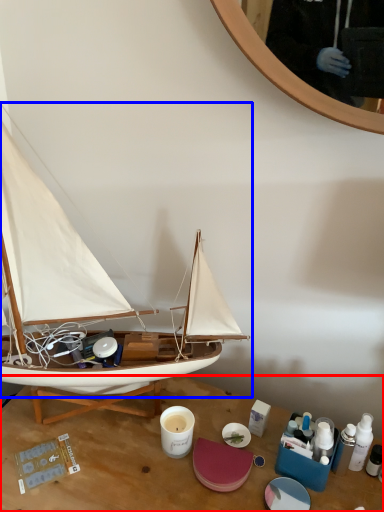
Question: Which object appears closest to the camera in this image, desk (highlighted by a red box) or boat (highlighted by a blue box)?

Choices:
 (A) desk
 (B) boat

Answer: (B)